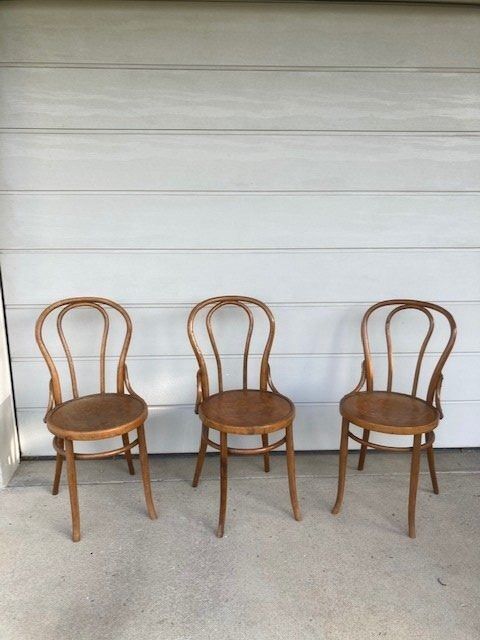
The width and height of the screenshot is (480, 640). I want to click on wooden wall panel, so click(x=75, y=22), click(x=72, y=90), click(x=75, y=150), click(x=78, y=209), click(x=91, y=262), click(x=143, y=332), click(x=152, y=369), click(x=168, y=420).